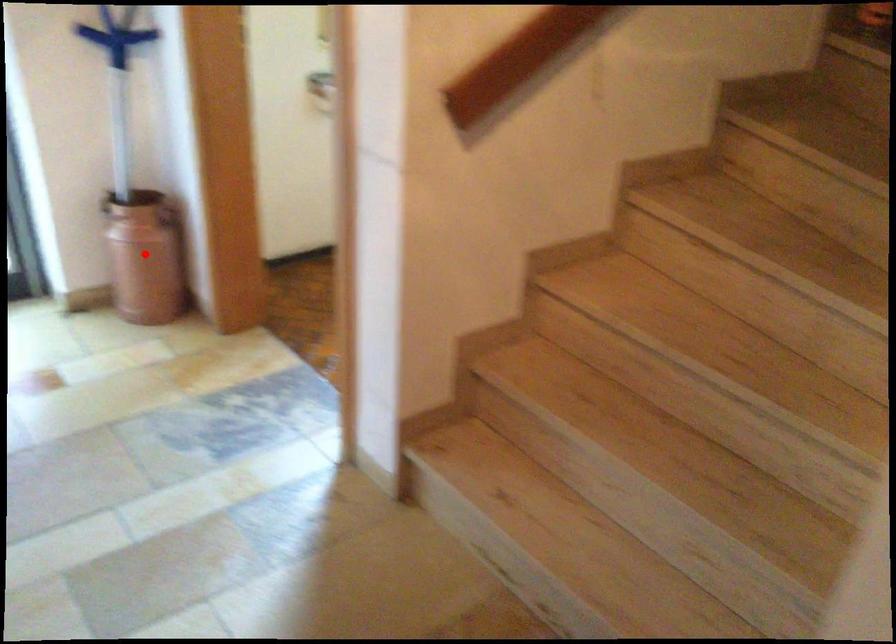
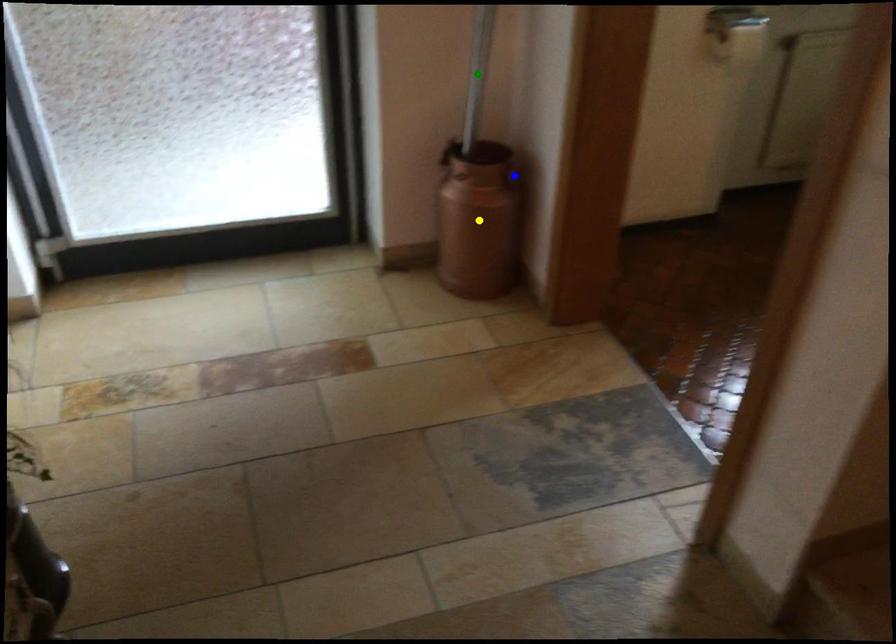
Question: I am providing you with two images of the same scene from different viewpoints. A red point is marked on the first image. You are given multiple points on the second image. In image 2, which mark is for the same physical point as the one in image 1?

Choices:
 (A) blue point
 (B) yellow point
 (C) green point

Answer: (B)